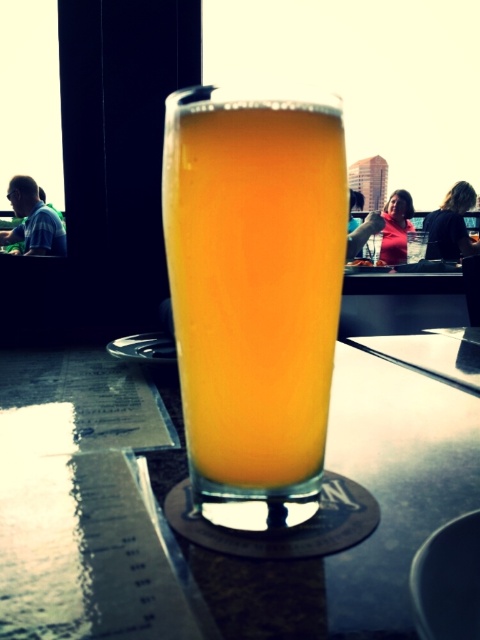
Who is taller, transparent glass at center or translucent glass beer at center?

translucent glass beer at center is taller.

Is transparent glass at center below translucent glass beer at center?

Yes.

Where is `transparent glass at center`? This screenshot has height=640, width=480. transparent glass at center is located at coordinates (81, 506).